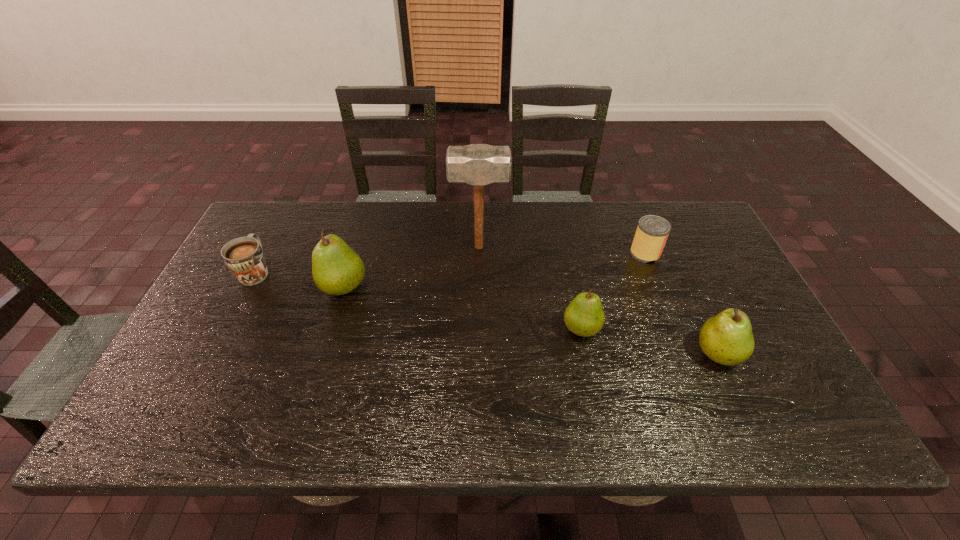
You are a GUI agent. You are given a task and a screenshot of the screen. Output one action in this format:
    pyautogui.click(x=<x>, y=<y>)
    Task: Click on the closest pear to the third tallest object
    The image size is (960, 540).
    Given the screenshot: What is the action you would take?
    pyautogui.click(x=584, y=316)

The height and width of the screenshot is (540, 960). I want to click on pear that can be found as the closest to the third shortest object, so click(727, 339).

Find the location of a particular element. vacant space that satisfies the following two spatial constraints: 1. on the front side of the third object from right to left; 2. on the left side of the leftmost pear is located at coordinates (331, 329).

Locate an element on the screen. vacant space that satisfies the following two spatial constraints: 1. on the striking face of the mallet; 2. on the right side of the fourth object from left to right is located at coordinates (479, 329).

In order to click on vacant space that satisfies the following two spatial constraints: 1. on the striking face of the fourth tallest object; 2. on the right side of the third object from left to right in this screenshot , I will do `click(479, 329)`.

Find the location of `free location that satisfies the following two spatial constraints: 1. on the front side of the shortest pear; 2. on the left side of the second object from left to right`. free location that satisfies the following two spatial constraints: 1. on the front side of the shortest pear; 2. on the left side of the second object from left to right is located at coordinates (331, 329).